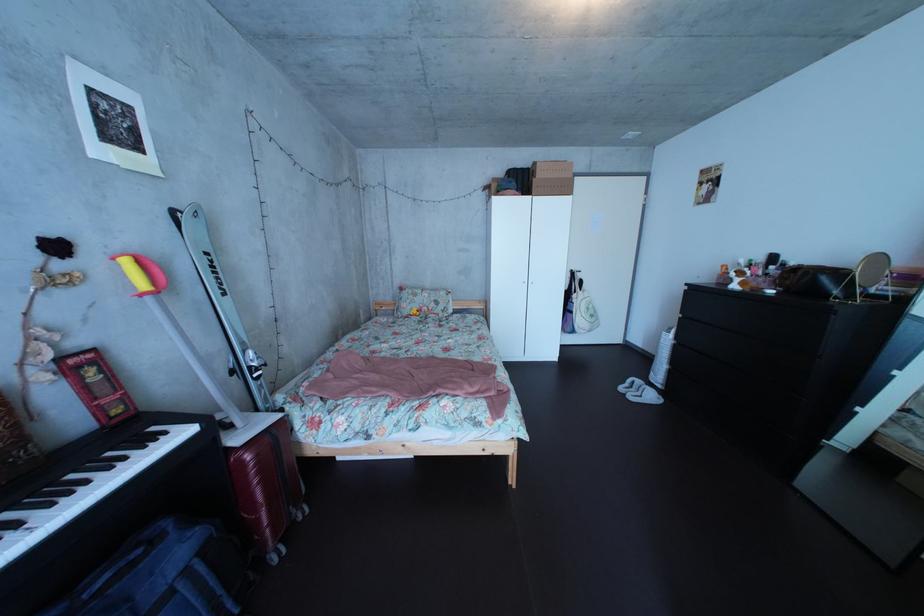
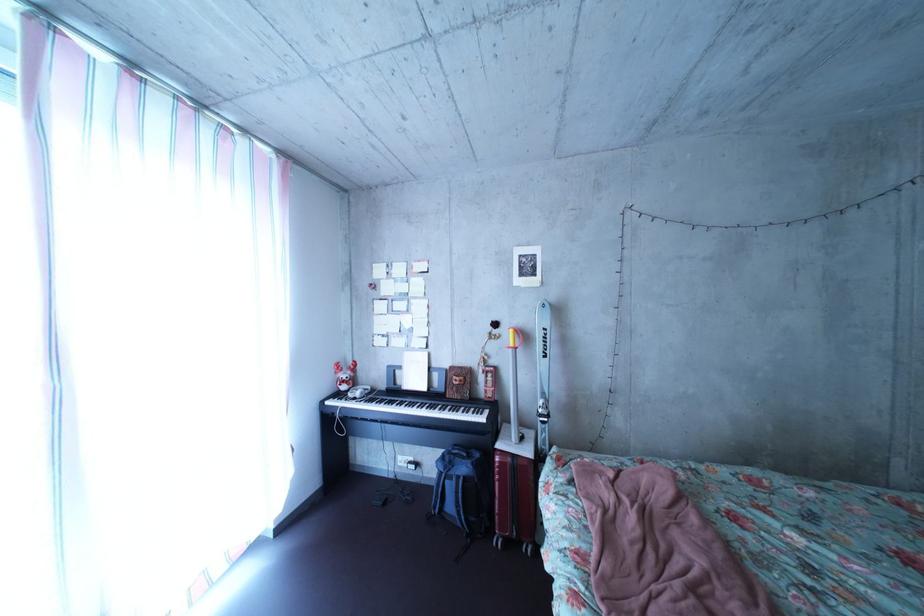
Where in the second image is the point corresponding to pixel 192 562 from the first image?

(479, 477)